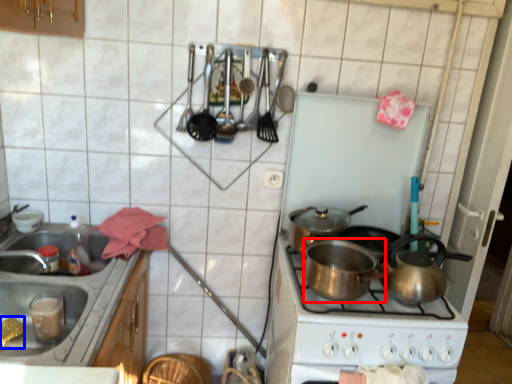
Question: Which point is further to the camera, kitchen appliance (highlighted by a red box) or food (highlighted by a blue box)?

Choices:
 (A) kitchen appliance
 (B) food

Answer: (B)